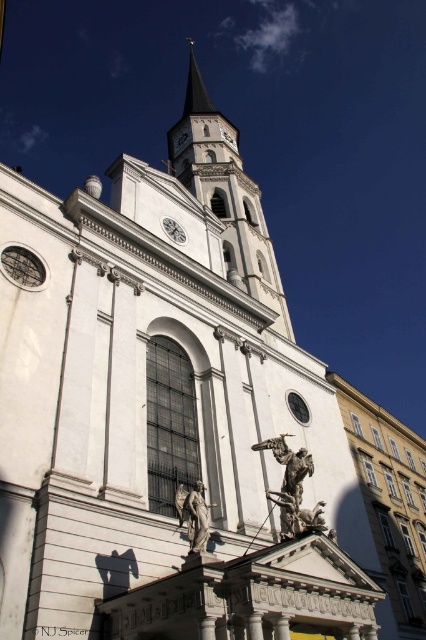
Based on the photo, can you confirm if white stone clock tower at upper center is positioned above bronze statue at center?

Correct, white stone clock tower at upper center is located above bronze statue at center.

Describe the element at coordinates (227, 195) in the screenshot. I see `white stone clock tower at upper center` at that location.

The height and width of the screenshot is (640, 426). Identify the location of white stone clock tower at upper center. pos(227,195).

Does white stone clock tower at upper center appear on the right side of polished bronze statue at lower center?

In fact, white stone clock tower at upper center is to the left of polished bronze statue at lower center.

Who is more distant from viewer, (230, 209) or (201, 529)?

The point (230, 209) is behind.

Where is `white stone clock tower at upper center`? This screenshot has height=640, width=426. white stone clock tower at upper center is located at coordinates (227, 195).

Is bronze statue at center above polished bronze statue at lower center?

No, bronze statue at center is not above polished bronze statue at lower center.

Who is more forward, [279,496] or [189,492]?

Point [279,496] is in front.

Who is more distant from viewer, (311, 515) or (207, 525)?

Point (311, 515)

The image size is (426, 640). Find the location of `bronze statue at center`. bronze statue at center is located at coordinates (293, 488).